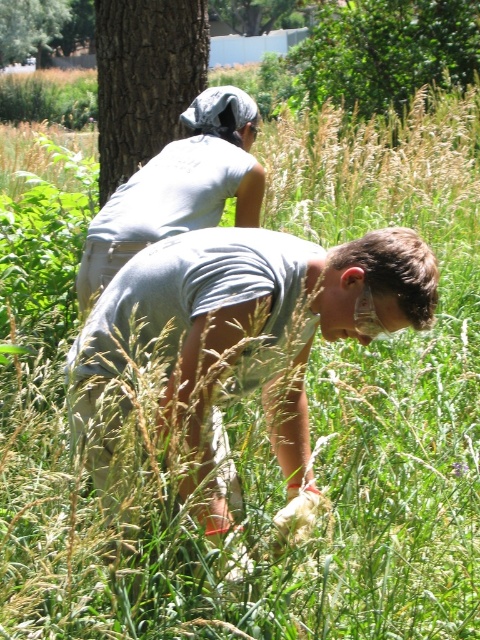
Who is lower down, brown rough tree at upper left or brown rough tree trunk at upper left?

brown rough tree at upper left is lower down.

Can you confirm if brown rough tree at upper left is positioned below brown rough tree trunk at upper left?

Correct, brown rough tree at upper left is located below brown rough tree trunk at upper left.

Is point (170, 3) positioned behind point (0, 8)?

No, it is not.

At what (x,y) coordinates should I click in order to perform the action: click on brown rough tree at upper left. Please return your answer as a coordinate pair (x, y). This screenshot has height=640, width=480. Looking at the image, I should click on (144, 77).

Measure the distance from gray matte shirt at upper center to brown rough tree trunk at upper left.

gray matte shirt at upper center and brown rough tree trunk at upper left are 98.22 feet apart.

Is point (93, 252) closer to viewer compared to point (33, 17)?

Yes, it is in front of point (33, 17).

Who is more distant from viewer, (187, 172) or (20, 29)?

The point (20, 29) is more distant.

This screenshot has width=480, height=640. I want to click on gray matte shirt at upper center, so click(x=179, y=188).

Is point (165, 195) positioned behind point (357, 1)?

No, (165, 195) is closer to viewer.

This screenshot has width=480, height=640. What do you see at coordinates (179, 188) in the screenshot?
I see `gray matte shirt at upper center` at bounding box center [179, 188].

You are a GUI agent. You are given a task and a screenshot of the screen. Output one action in this format:
    pyautogui.click(x=<x>, y=<y>)
    Task: Click on the gray matte shirt at upper center
    The width and height of the screenshot is (480, 640).
    Given the screenshot: What is the action you would take?
    pyautogui.click(x=179, y=188)